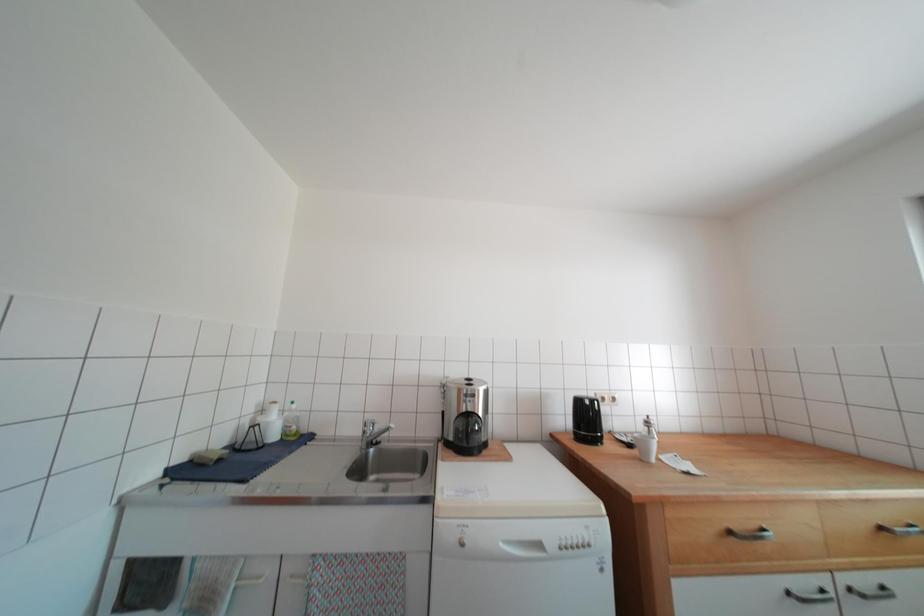
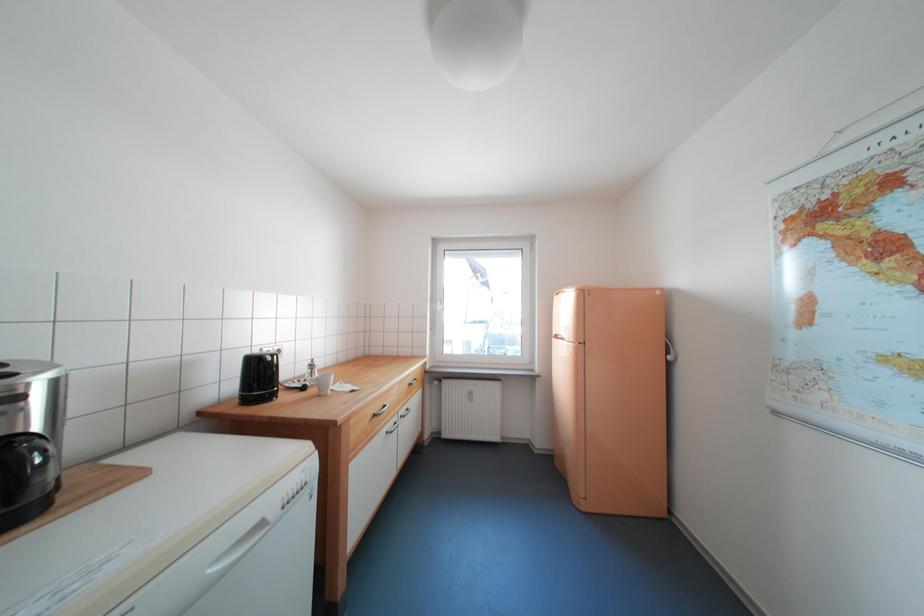
Question: The images are taken continuously from a first-person perspective. In which direction is your viewpoint rotating?

Choices:
 (A) Left
 (B) Right
 (C) Up
 (D) Down

Answer: (B)